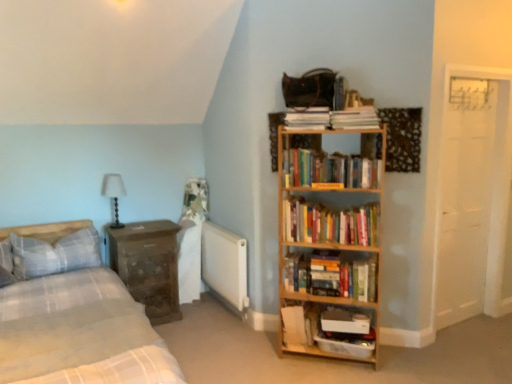
In order to face wooden bookshelf at upper right, which ranks as the 1th book in top-to-bottom order, should I rotate leftwards or rightwards?

Turn right by 10.372 degrees to look at wooden bookshelf at upper right, which ranks as the 1th book in top-to-bottom order.

What do you see at coordinates (114, 194) in the screenshot?
I see `white fabric lampshade at left` at bounding box center [114, 194].

Identify the location of white matte radiator at center. (225, 267).

What do you see at coordinates (334, 275) in the screenshot? This screenshot has width=512, height=384. I see `hardcover books at center, which ranks as the first book in bottom-to-top order` at bounding box center [334, 275].

The height and width of the screenshot is (384, 512). I want to click on wooden bookshelf at upper right, which ranks as the 1th book in top-to-bottom order, so click(x=329, y=169).

Where is `pillow in front of the wooden nightstand at left`? pillow in front of the wooden nightstand at left is located at coordinates (55, 254).

Is plaid fabric pillow at left turned away from wooden nightstand at left?

No, wooden nightstand at left is not at the back of plaid fabric pillow at left.

Is plaid fabric pillow at left not close to wooden nightstand at left?

That's not correct — plaid fabric pillow at left is a little close to wooden nightstand at left.

Based on the photo, is plaid fabric pillow at left spatially inside wooden nightstand at left, or outside of it?

plaid fabric pillow at left is located beyond the bounds of wooden nightstand at left.

From a real-world perspective, which is physically above, white paper at upper center, the 2th paperback book when ordered from top to bottom, or wooden bookshelf at upper right, which ranks as the 1th book in top-to-bottom order?

In real-world perspective, white paper at upper center, the 2th paperback book when ordered from top to bottom, is above.

Does white paper at upper center, the 2th paperback book when ordered from top to bottom, turn towards wooden bookshelf at upper right, marked as the 3th book in a bottom-to-top arrangement?

No, white paper at upper center, the 2th paperback book when ordered from top to bottom, does not turn towards wooden bookshelf at upper right, marked as the 3th book in a bottom-to-top arrangement.

Would you say white paper at upper center, the 2th paperback book when ordered from top to bottom, contains wooden bookshelf at upper right, marked as the 3th book in a bottom-to-top arrangement?

No, wooden bookshelf at upper right, marked as the 3th book in a bottom-to-top arrangement, is located outside of white paper at upper center, the 2th paperback book when ordered from top to bottom.

Are hardcover book at upper center, which is counted as the 1th paperback book, starting from the top, and wooden bookshelf at right, the 1th shelf in the top-to-bottom sequence, far apart?

No, hardcover book at upper center, which is counted as the 1th paperback book, starting from the top, is not far from wooden bookshelf at right, the 1th shelf in the top-to-bottom sequence.

Would you say hardcover book at upper center, which is counted as the 1th paperback book, starting from the top, is outside wooden bookshelf at right, the 2th shelf positioned from the bottom?

hardcover book at upper center, which is counted as the 1th paperback book, starting from the top, lies outside wooden bookshelf at right, the 2th shelf positioned from the bottom,'s area.

Considering the relative sizes of hardcover book at upper center, which is counted as the 1th paperback book, starting from the top, and wooden bookshelf at right, the 1th shelf in the top-to-bottom sequence, in the image provided, is hardcover book at upper center, which is counted as the 1th paperback book, starting from the top, thinner than wooden bookshelf at right, the 1th shelf in the top-to-bottom sequence,?

Indeed, hardcover book at upper center, which is counted as the 1th paperback book, starting from the top, has a lesser width compared to wooden bookshelf at right, the 1th shelf in the top-to-bottom sequence.

From the image's perspective, which one is positioned higher, hardcover book at upper center, the 3th paperback book from the bottom, or wooden bookshelf at right, the 2th shelf positioned from the bottom?

hardcover book at upper center, the 3th paperback book from the bottom, is shown above in the image.

Is plaid fabric pillow at left inside the boundaries of hardcover books at center, marked as the third book in a top-to-bottom arrangement, or outside?

plaid fabric pillow at left lies outside hardcover books at center, marked as the third book in a top-to-bottom arrangement.

Image resolution: width=512 pixels, height=384 pixels. I want to click on the 3rd book to the right when counting from the plaid fabric pillow at left, so click(334, 275).

Considering the sizes of plaid fabric pillow at left and hardcover books at center, which ranks as the first book in bottom-to-top order, in the image, is plaid fabric pillow at left wider or thinner than hardcover books at center, which ranks as the first book in bottom-to-top order,?

Clearly, plaid fabric pillow at left has more width compared to hardcover books at center, which ranks as the first book in bottom-to-top order.

Is plaid fabric pillow at left looking in the opposite direction of hardcover books at center, which ranks as the first book in bottom-to-top order?

No, hardcover books at center, which ranks as the first book in bottom-to-top order, is not at the back of plaid fabric pillow at left.

Between hardcover books at center, marked as the third book in a top-to-bottom arrangement, and hardcover books at center right, the 2th book from the top, which one has less height?

hardcover books at center, marked as the third book in a top-to-bottom arrangement, is shorter.

Is hardcover books at center, marked as the third book in a top-to-bottom arrangement, looking in the opposite direction of hardcover books at center right, the 2th book from the top?

No.

Based on the photo, from a real-world perspective, is hardcover books at center, which ranks as the first book in bottom-to-top order, physically above hardcover books at center right, the 2th book from the top?

Actually, hardcover books at center, which ranks as the first book in bottom-to-top order, is physically below hardcover books at center right, the 2th book from the top, in the real world.

Between hardcover book at center, marked as the first paperback book in a bottom-to-top arrangement, and wooden bookshelf at upper right, which ranks as the 1th book in top-to-bottom order, which one appears on the right side from the viewer's perspective?

wooden bookshelf at upper right, which ranks as the 1th book in top-to-bottom order.

Who is bigger, hardcover book at center, marked as the first paperback book in a bottom-to-top arrangement, or wooden bookshelf at upper right, which ranks as the 1th book in top-to-bottom order?

Bigger between the two is wooden bookshelf at upper right, which ranks as the 1th book in top-to-bottom order.

How distant is hardcover book at center, the 3th paperback book from the top, from wooden bookshelf at upper right, marked as the 3th book in a bottom-to-top arrangement?

hardcover book at center, the 3th paperback book from the top, is 1.00 meters away from wooden bookshelf at upper right, marked as the 3th book in a bottom-to-top arrangement.

Between point (292, 342) and point (375, 172), which one is positioned behind?

The point (292, 342) is more distant.

Considering the relative positions of wooden bookshelf at upper right, marked as the 3th book in a bottom-to-top arrangement, and wooden nightstand at left in the image provided, is wooden bookshelf at upper right, marked as the 3th book in a bottom-to-top arrangement, to the left of wooden nightstand at left from the viewer's perspective?

In fact, wooden bookshelf at upper right, marked as the 3th book in a bottom-to-top arrangement, is to the right of wooden nightstand at left.

Does wooden bookshelf at upper right, marked as the 3th book in a bottom-to-top arrangement, come behind wooden nightstand at left?

That is False.

Looking at this image, which of these two, wooden bookshelf at upper right, which ranks as the 1th book in top-to-bottom order, or wooden nightstand at left, stands taller?

wooden nightstand at left is taller.

From the image's perspective, between wooden bookshelf at upper right, which ranks as the 1th book in top-to-bottom order, and wooden nightstand at left, who is located below?

From the image's view, wooden nightstand at left is below.

This screenshot has width=512, height=384. I want to click on nightstand on the right of plaid fabric pillow at left, so click(x=148, y=266).

The image size is (512, 384). In order to click on the 3rd book to the left of the white paper at upper center, the second paperback book positioned from the bottom, counting from the anchor's position in this screenshot , I will do `click(329, 169)`.

Considering their positions, is wooden bookshelf at right, the 2th shelf positioned from the bottom, positioned closer to plaid fabric pillow at left than wooden nightstand at left?

The object closer to plaid fabric pillow at left is wooden nightstand at left.

When comparing their distances from plaid fabric pillow at left, does white paper at upper center, the 2th paperback book when ordered from top to bottom, or plaid fabric bed at left seem further?

Among the two, white paper at upper center, the 2th paperback book when ordered from top to bottom, is located further to plaid fabric pillow at left.

From the picture: Estimate the real-world distances between objects in this image. Which object is further from hardcover books at center right, marked as the 2th book in a bottom-to-top arrangement, plaid fabric pillow at left or white matte radiator at center?

The object further to hardcover books at center right, marked as the 2th book in a bottom-to-top arrangement, is plaid fabric pillow at left.

Considering their positions, is hardcover book at upper center, which is counted as the 1th paperback book, starting from the top, positioned further to wooden bookshelf at upper right, marked as the 3th book in a bottom-to-top arrangement, than hardcover books at center, marked as the third book in a top-to-bottom arrangement?

Among the two, hardcover books at center, marked as the third book in a top-to-bottom arrangement, is located further to wooden bookshelf at upper right, marked as the 3th book in a bottom-to-top arrangement.

From the image, which object appears to be farther from white plastic container at lower center, the 1th shelf in the bottom-to-top sequence, plaid fabric pillow at left or hardcover books at center right, marked as the 2th book in a bottom-to-top arrangement?

plaid fabric pillow at left is positioned further to the anchor white plastic container at lower center, the 1th shelf in the bottom-to-top sequence.

From the picture: Based on their spatial positions, is wooden bookshelf at right, the 2th shelf positioned from the bottom, or wooden nightstand at left closer to hardcover book at center, the 3th paperback book from the top?

wooden bookshelf at right, the 2th shelf positioned from the bottom, lies closer to hardcover book at center, the 3th paperback book from the top, than the other object.

Based on their spatial positions, is wooden bookshelf at upper right, which ranks as the 1th book in top-to-bottom order, or hardcover books at center right, the 2th book from the top, further from hardcover book at upper center, which is counted as the 1th paperback book, starting from the top?

hardcover books at center right, the 2th book from the top, is further to hardcover book at upper center, which is counted as the 1th paperback book, starting from the top.

Estimate the real-world distances between objects in this image. Which object is closer to hardcover book at upper center, the 3th paperback book from the bottom, plaid fabric pillow at left or hardcover book at center, marked as the first paperback book in a bottom-to-top arrangement?

hardcover book at center, marked as the first paperback book in a bottom-to-top arrangement, lies closer to hardcover book at upper center, the 3th paperback book from the bottom, than the other object.

This screenshot has height=384, width=512. Find the location of `nightstand between plaid fabric bed at left and white matte radiator at center in the front-back direction`. nightstand between plaid fabric bed at left and white matte radiator at center in the front-back direction is located at coordinates (148, 266).

The width and height of the screenshot is (512, 384). I want to click on radiator between white fabric lampshade at left and white plastic container at lower center, the second shelf in the top-to-bottom sequence, so click(225, 267).

Locate an element on the screen. This screenshot has width=512, height=384. paperback book between hardcover book at upper center, the 3th paperback book from the bottom, and wooden bookshelf at upper right, marked as the 3th book in a bottom-to-top arrangement, vertically is located at coordinates (355, 118).

Where is `table lamp between plaid fabric pillow at left and white plastic container at lower center, the 1th shelf in the bottom-to-top sequence, in the horizontal direction`? table lamp between plaid fabric pillow at left and white plastic container at lower center, the 1th shelf in the bottom-to-top sequence, in the horizontal direction is located at coordinates (114, 194).